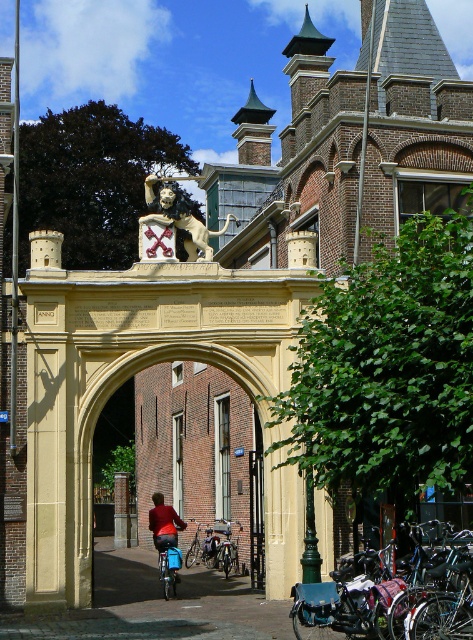
Does beige stone archway at center appear under brick pillar at center?

Actually, beige stone archway at center is above brick pillar at center.

Does point (99, 452) come in front of point (113, 534)?

No, it is not.

Identify the location of beige stone archway at center. (202, 456).

Which is above, red fabric jacket at center or brushed metal bicycle at center?

red fabric jacket at center is higher up.

Between point (155, 500) and point (166, 554), which one is positioned behind?

Point (155, 500)

In order to click on red fabric jacket at center in this screenshot , I will do `click(164, 524)`.

This screenshot has width=473, height=640. Identify the location of red fabric jacket at center. (164, 524).

Does shiny black bicycle at lower right have a greater width compared to brick pillar at center?

Yes, shiny black bicycle at lower right is wider than brick pillar at center.

Is point (444, 572) positioned in front of point (125, 509)?

That is True.

Locate an element on the screen. shiny black bicycle at lower right is located at coordinates pyautogui.click(x=393, y=595).